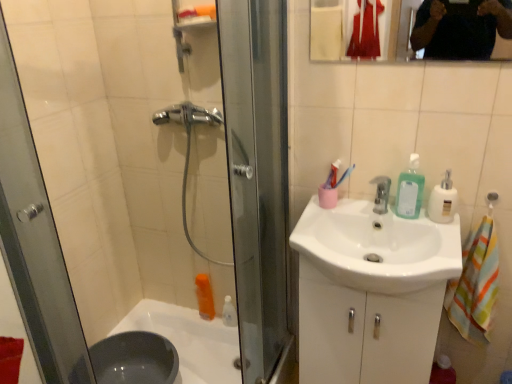
Question: From the image's perspective, relative to white glossy sink at center, is green translucent liquid soap at upper right above or below?

Choices:
 (A) above
 (B) below

Answer: (A)

Question: Is green translucent liquid soap at upper right taller or shorter than white glossy sink at center?

Choices:
 (A) tall
 (B) short

Answer: (B)

Question: Which is nearer to the white glossy bathtub at lower left?

Choices:
 (A) multicolored fabric towel at right
 (B) white glossy cabinet at lower right
 (C) silver metallic faucet at center
 (D) green translucent liquid soap at upper right
 (E) white plastic soap dispenser at right

Answer: (B)

Question: Considering the real-world distances, which object is closest to the white glossy bathtub at lower left?

Choices:
 (A) green translucent liquid soap at upper right
 (B) white glossy cabinet at lower right
 (C) white glossy sink at center
 (D) multicolored fabric towel at right
 (E) silver metallic faucet at center

Answer: (B)